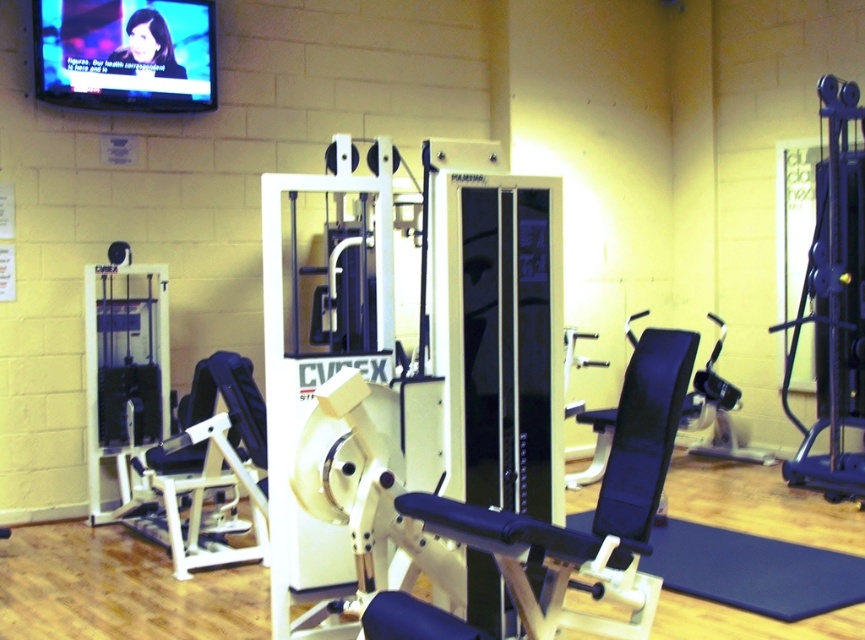
Question: Is matte black television at upper left thinner than blue rubber mat at lower right?

Choices:
 (A) no
 (B) yes

Answer: (B)

Question: Does matte black television at upper left have a greater width compared to blue rubber mat at lower right?

Choices:
 (A) yes
 (B) no

Answer: (B)

Question: Which point is closer to the camera taking this photo?

Choices:
 (A) (761, 568)
 (B) (152, 100)

Answer: (A)

Question: Among these objects, which one is nearest to the camera?

Choices:
 (A) blue rubber mat at lower right
 (B) matte black television at upper left

Answer: (A)

Question: Is matte black television at upper left smaller than blue rubber mat at lower right?

Choices:
 (A) yes
 (B) no

Answer: (B)